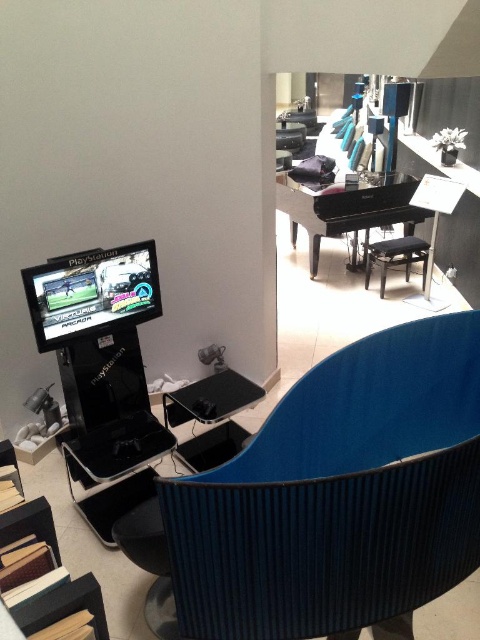
Question: Based on their relative distances, which object is nearer to the shiny black arcade machine at left?

Choices:
 (A) blue fabric swivel chair at lower right
 (B) black leather stool at center

Answer: (A)

Question: Considering the real-world distances, which object is farthest from the blue fabric swivel chair at lower right?

Choices:
 (A) shiny black arcade machine at left
 (B) black leather stool at center

Answer: (B)

Question: Is blue fabric swivel chair at lower right further to the viewer compared to shiny black arcade machine at left?

Choices:
 (A) yes
 (B) no

Answer: (B)

Question: Is blue fabric swivel chair at lower right bigger than shiny black arcade machine at left?

Choices:
 (A) no
 (B) yes

Answer: (B)

Question: Which object is closer to the camera taking this photo?

Choices:
 (A) shiny black arcade machine at left
 (B) black leather stool at center
 (C) blue fabric swivel chair at lower right

Answer: (C)

Question: Is blue fabric swivel chair at lower right smaller than shiny black arcade machine at left?

Choices:
 (A) no
 (B) yes

Answer: (A)